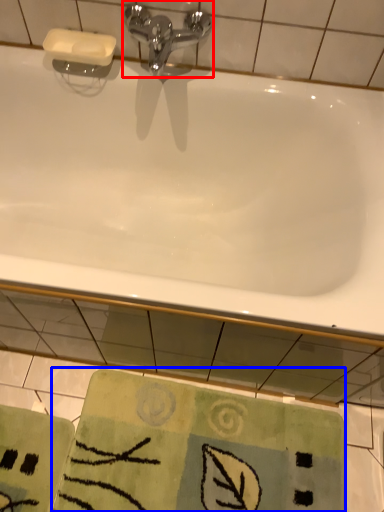
Question: Which object appears closest to the camera in this image, tap (highlighted by a red box) or beach towel (highlighted by a blue box)?

Choices:
 (A) tap
 (B) beach towel

Answer: (A)